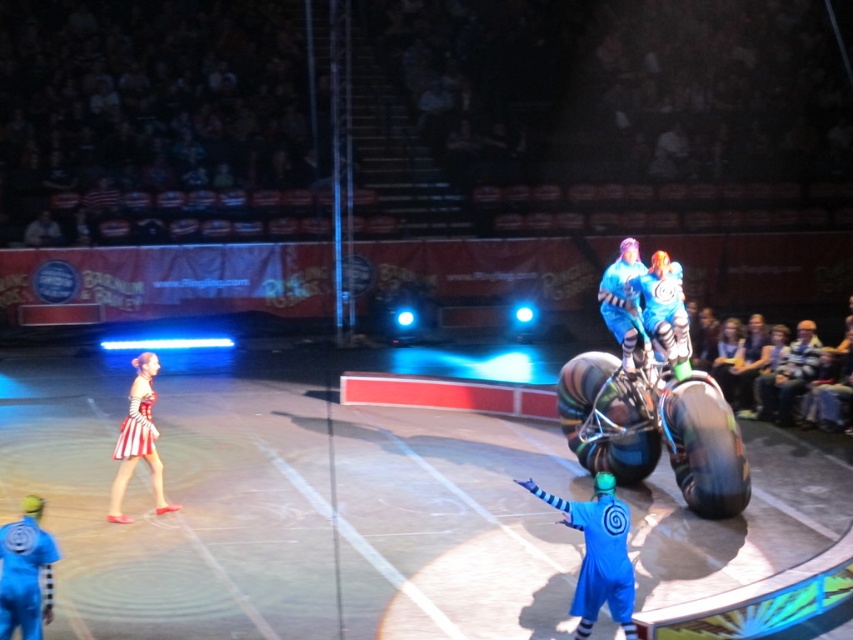
Question: Estimate the real-world distances between objects in this image. Which object is farther from the blue shiny helmet at upper center?

Choices:
 (A) striped fabric dress at left
 (B) blue fabric at center
 (C) blue matte clown at lower left
 (D) blue fabric jacket at right

Answer: (C)

Question: Does blue fabric at center lie in front of blue fabric jacket at right?

Choices:
 (A) yes
 (B) no

Answer: (A)

Question: Among these objects, which one is farthest from the camera?

Choices:
 (A) blue fabric at center
 (B) blue shiny helmet at upper center

Answer: (B)

Question: Among these objects, which one is nearest to the camera?

Choices:
 (A) blue fabric at center
 (B) blue fabric jacket at right
 (C) blue shiny helmet at upper center

Answer: (A)

Question: Does blue fabric jacket at right have a lesser width compared to blue matte clown at lower left?

Choices:
 (A) yes
 (B) no

Answer: (B)

Question: Is blue fabric jacket at right positioned before striped fabric dress at left?

Choices:
 (A) yes
 (B) no

Answer: (B)